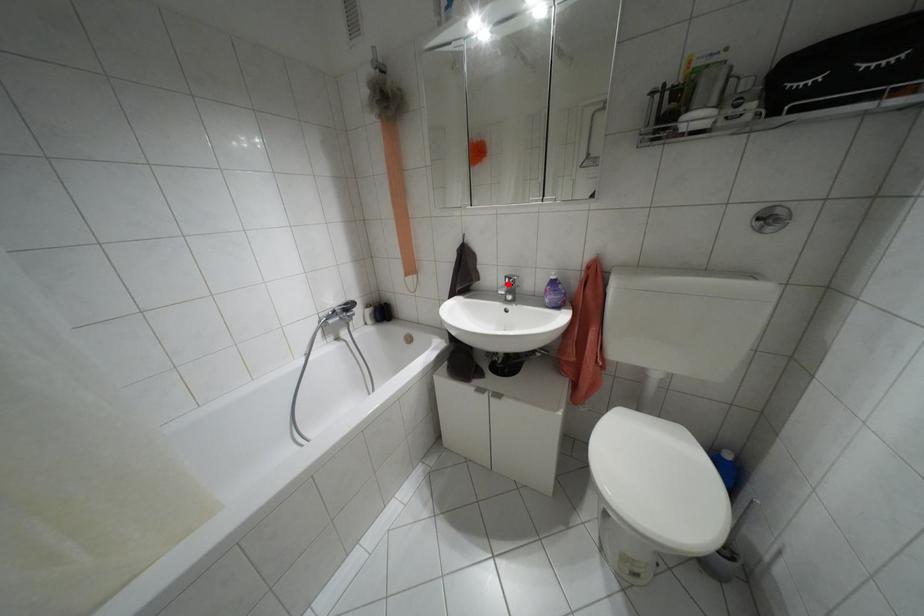
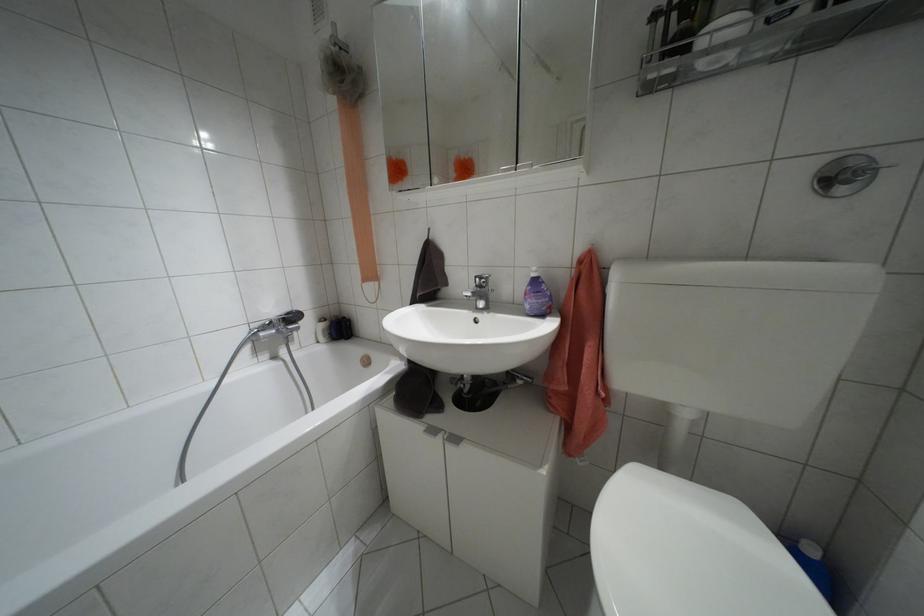
Locate, in the second image, the point that corresponds to the highlighted location in the first image.

(479, 286)